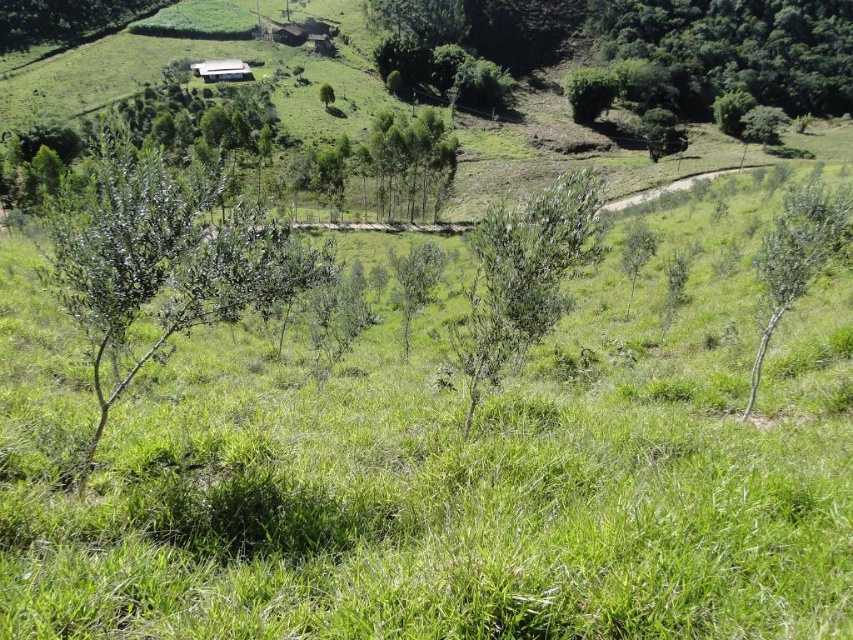
Based on the photo, does green leafy tree at right have a greater height compared to brown wooden hut at center?

Incorrect, green leafy tree at right's height is not larger of brown wooden hut at center's.

Is point (751, 378) farther from camera compared to point (287, 22)?

That is False.

Who is more forward, [786,305] or [316,35]?

Point [786,305]

Find the location of a particular element. green leafy tree at right is located at coordinates (795, 253).

Which is above, green leafy shrub at left or green leafy shrub at center?

Positioned higher is green leafy shrub at left.

Which is behind, point (117, 326) or point (537, 202)?

The point (537, 202) is behind.

Which is in front, point (253, 230) or point (517, 296)?

Point (253, 230) is more forward.

Locate an element on the screen. The height and width of the screenshot is (640, 853). green leafy shrub at left is located at coordinates (160, 259).

Is green leafy shrub at center smaller than white corrugated metal hut at upper center?

Actually, green leafy shrub at center might be larger than white corrugated metal hut at upper center.

Between green leafy shrub at center and white corrugated metal hut at upper center, which one appears on the left side from the viewer's perspective?

white corrugated metal hut at upper center

Is point (509, 268) closer to viewer compared to point (218, 74)?

That is True.

Locate an element on the screen. Image resolution: width=853 pixels, height=640 pixels. green leafy shrub at center is located at coordinates (523, 275).